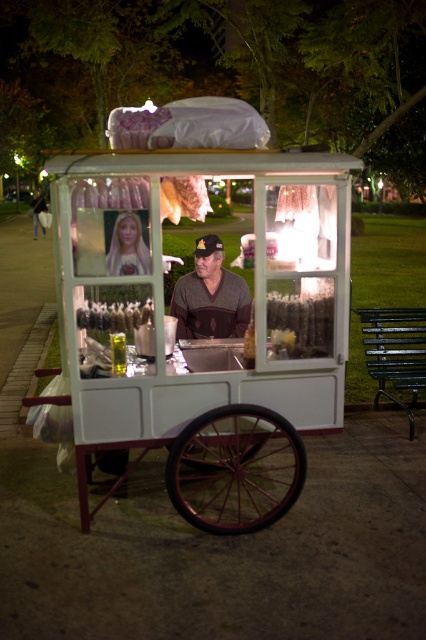
You are a customer standing in front of the food cart. You notice two items at the center of the cart. Which one is taller, the blonde hair at center or the white plastic popcorn at center?

The blonde hair at center is taller than the white plastic popcorn at center.